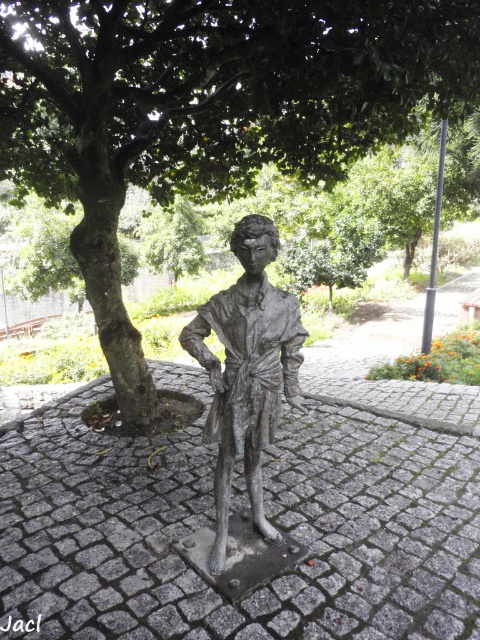
Question: Does green leafy tree at center appear on the right side of bronze statue at center?

Choices:
 (A) no
 (B) yes

Answer: (A)

Question: Which point appears closest to the camera in this image?

Choices:
 (A) (220, 564)
 (B) (264, 124)

Answer: (A)

Question: Which point is closer to the camera taking this photo?

Choices:
 (A) (237, 284)
 (B) (232, 90)

Answer: (A)

Question: Can you confirm if green leafy tree at center is bigger than bronze statue at center?

Choices:
 (A) yes
 (B) no

Answer: (A)

Question: Considering the relative positions of green leafy tree at center and bronze statue at center in the image provided, where is green leafy tree at center located with respect to bronze statue at center?

Choices:
 (A) right
 (B) left

Answer: (B)

Question: Which object is farther from the camera taking this photo?

Choices:
 (A) green leafy tree at center
 (B) bronze statue at center

Answer: (A)